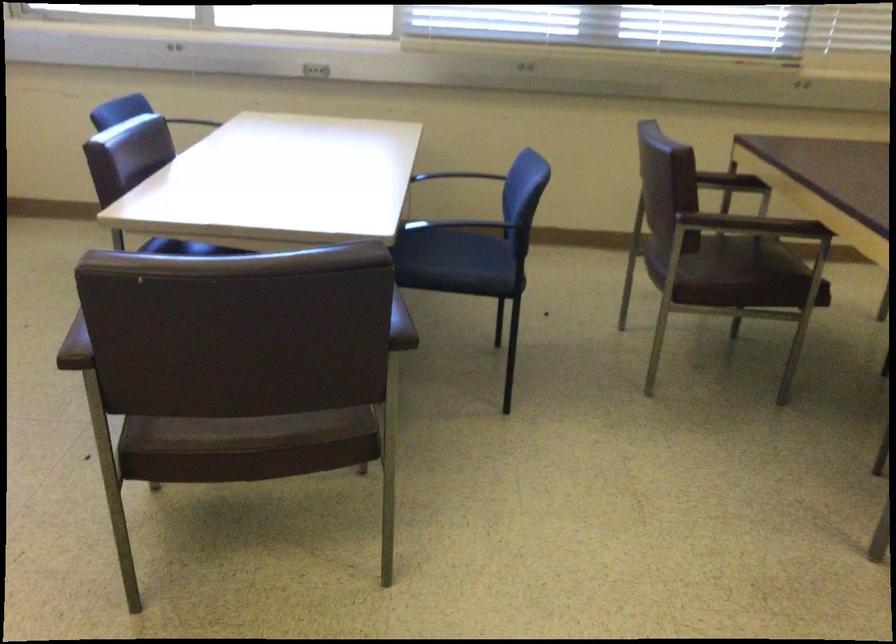
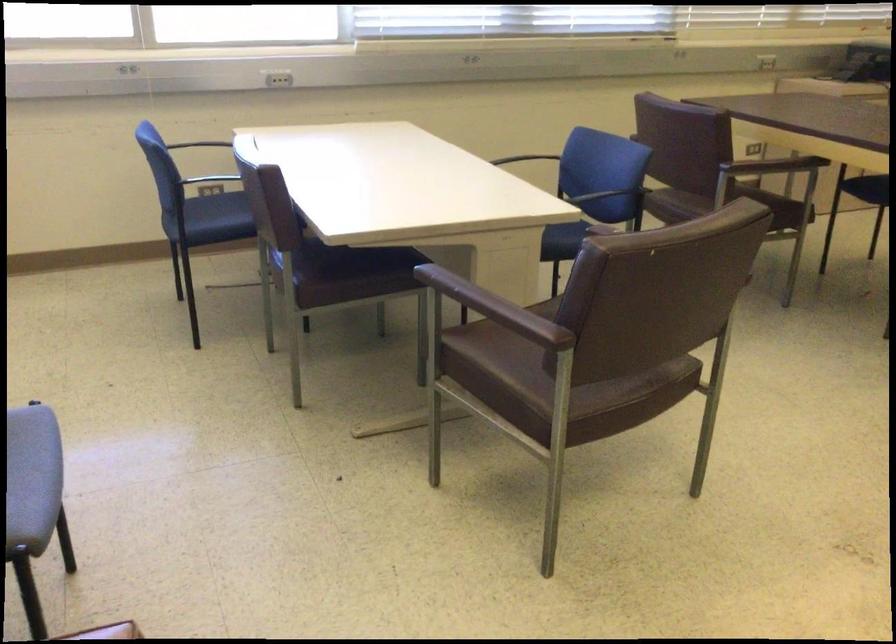
Find the pixel in the second image that matches (x=569, y=181) in the first image.

(521, 158)